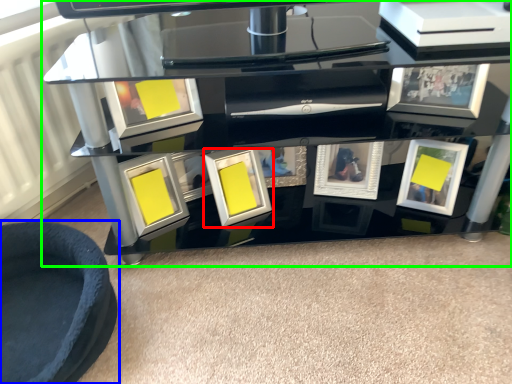
Question: Based on their relative distances, which object is nearer to picture frame (highlighted by a red box)? Choose from furniture (highlighted by a blue box) and table (highlighted by a green box).

Choices:
 (A) furniture
 (B) table

Answer: (B)